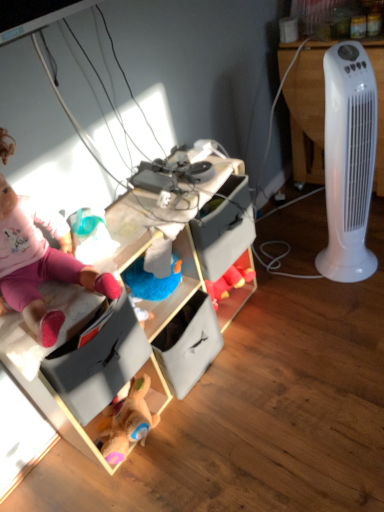
Question: Considering the positions of pink fabric doll at upper left and white plastic tower fan at right in the image, is pink fabric doll at upper left bigger or smaller than white plastic tower fan at right?

Choices:
 (A) big
 (B) small

Answer: (A)

Question: Would you say pink fabric doll at upper left is to the left or to the right of white plastic tower fan at right in the picture?

Choices:
 (A) right
 (B) left

Answer: (B)

Question: Considering the real-world distances, which object is farthest from the white plastic tower fan at right?

Choices:
 (A) white plastic tower fan at right
 (B) pink fabric doll at upper left
 (C) wooden toy storage at center

Answer: (B)

Question: Which object is positioned farthest from the white plastic tower fan at right?

Choices:
 (A) white plastic tower fan at right
 (B) pink fabric doll at upper left
 (C) wooden toy storage at center

Answer: (B)